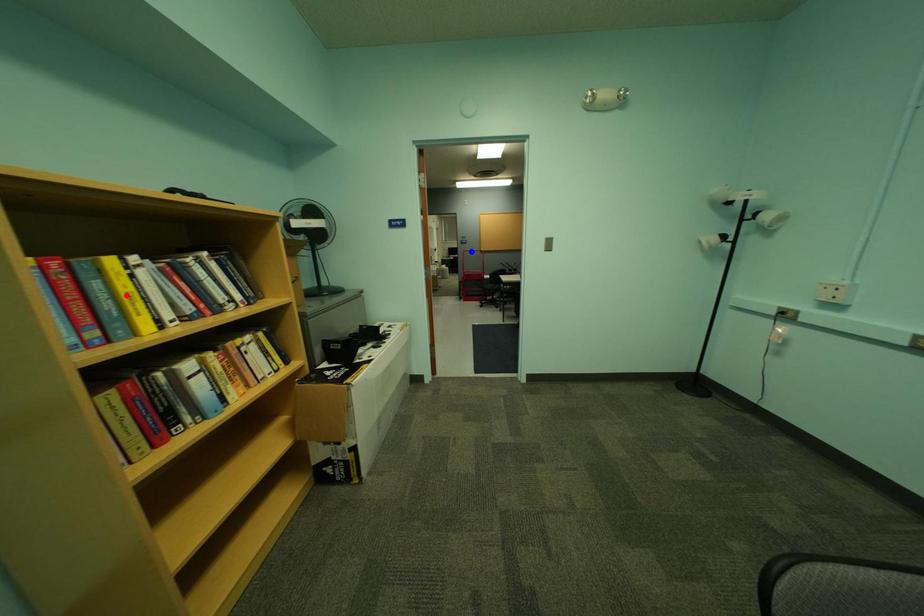
Question: In the image, two points are highlighted. Which point is nearer to the camera? Reply with the corresponding letter.

Choices:
 (A) blue point
 (B) red point

Answer: (B)